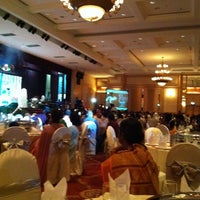
Where is `black lights on celing`? This screenshot has height=200, width=200. black lights on celing is located at coordinates (72, 50).